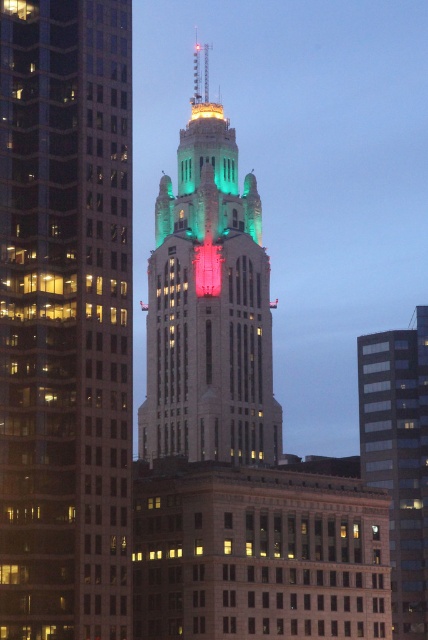
In the scene shown: You are a photographer standing in front of the skyscraper. You want to capture the green stone tower at center and the glassy reflective skyscraper at center in the same frame. Which object should you position to the left side of your camera frame?

You should position the green stone tower at center to the left side of your camera frame since it is already located to the left of the glassy reflective skyscraper at center in the scene.

You are standing in front of two skyscrapers in the image. The green glass skyscraper at center and the glassy reflective skyscraper at center. Which one do you think is closer to you?

The green glass skyscraper at center is closer to the viewer than the glassy reflective skyscraper at center.

You are an architect analyzing the layout of the city skyline. You observe the green stone tower at center and the glassy reflective skyscraper at center. Which structure appears to be situated higher in the image?

The green stone tower at center is positioned over the glassy reflective skyscraper at center, so it appears higher in the image.